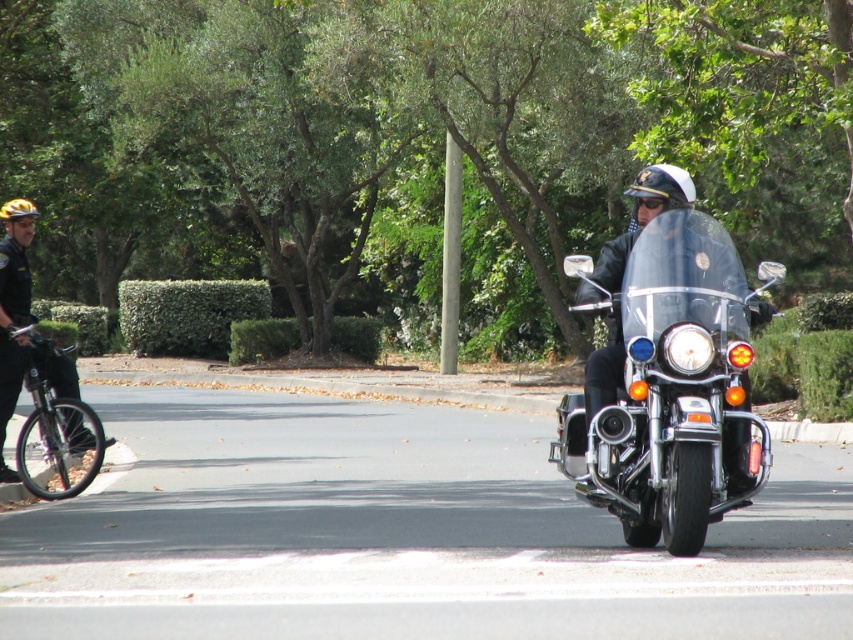
Question: Does black glossy motorcycle at center have a lesser width compared to black matte bicycle at left?

Choices:
 (A) no
 (B) yes

Answer: (A)

Question: Is black glossy motorcycle at center below black matte bicycle at left?

Choices:
 (A) no
 (B) yes

Answer: (A)

Question: Among these objects, which one is farthest from the camera?

Choices:
 (A) black matte bicycle at left
 (B) black glossy motorcycle at center

Answer: (A)

Question: Observing the image, what is the correct spatial positioning of black glossy motorcycle at center in reference to black matte bicycle at left?

Choices:
 (A) below
 (B) above

Answer: (B)

Question: Which point is farther from the camera taking this photo?

Choices:
 (A) (62, 468)
 (B) (674, 252)

Answer: (A)